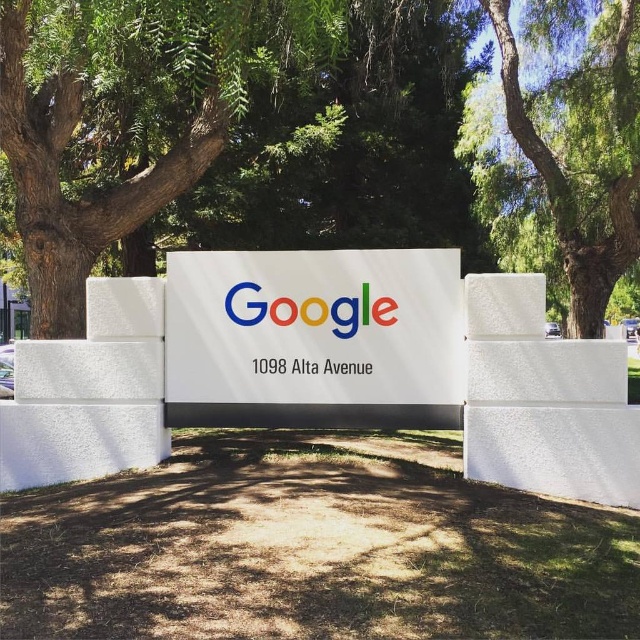
Question: Among these objects, which one is nearest to the camera?

Choices:
 (A) multicolored plastic google sign at center
 (B) green leafy tree at upper center
 (C) green leafy tree at center
 (D) white glossy sign at center

Answer: (C)

Question: Is green leafy tree at upper center bigger than multicolored plastic google sign at center?

Choices:
 (A) yes
 (B) no

Answer: (A)

Question: Which of the following is the closest to the observer?

Choices:
 (A) green leafy tree at center
 (B) white glossy sign at center

Answer: (A)

Question: Is white glossy sign at center to the left of green leafy tree at upper center from the viewer's perspective?

Choices:
 (A) yes
 (B) no

Answer: (A)

Question: Among these objects, which one is farthest from the camera?

Choices:
 (A) green leafy tree at center
 (B) multicolored plastic google sign at center
 (C) green leafy tree at upper center
 (D) white glossy sign at center

Answer: (C)

Question: Can you confirm if green leafy tree at center is positioned above multicolored plastic google sign at center?

Choices:
 (A) no
 (B) yes

Answer: (B)